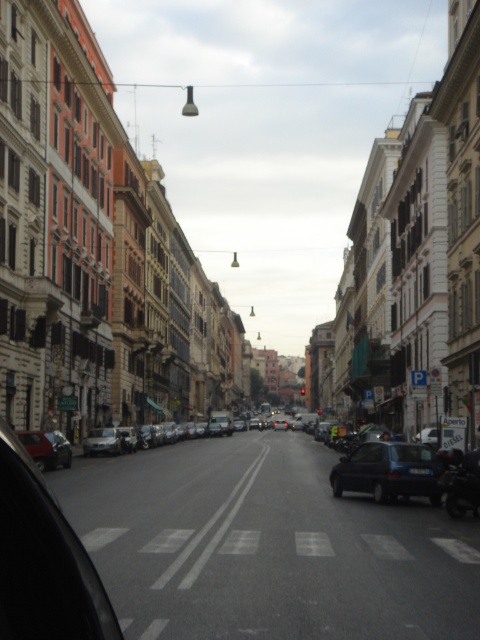
Question: Is the position of silver metallic sedan at left less distant than that of blue plastic license plate at center-right?

Choices:
 (A) yes
 (B) no

Answer: (B)

Question: Which of the following is the farthest from the observer?

Choices:
 (A) matte black car at lower left
 (B) silver metallic sedan at left

Answer: (B)

Question: Can you confirm if matte black car at lower left is positioned to the right of blue plastic license plate at center-right?

Choices:
 (A) yes
 (B) no

Answer: (B)

Question: Among these objects, which one is nearest to the camera?

Choices:
 (A) blue plastic license plate at center-right
 (B) matte black car at lower left
 (C) blue metallic car at center

Answer: (C)

Question: Which object appears farthest from the camera in this image?

Choices:
 (A) matte black car at lower left
 (B) silver metallic sedan at left
 (C) blue metallic car at center
 (D) blue plastic license plate at center-right

Answer: (B)

Question: In this image, where is matte black car at lower left located relative to blue plastic license plate at center-right?

Choices:
 (A) right
 (B) left

Answer: (B)